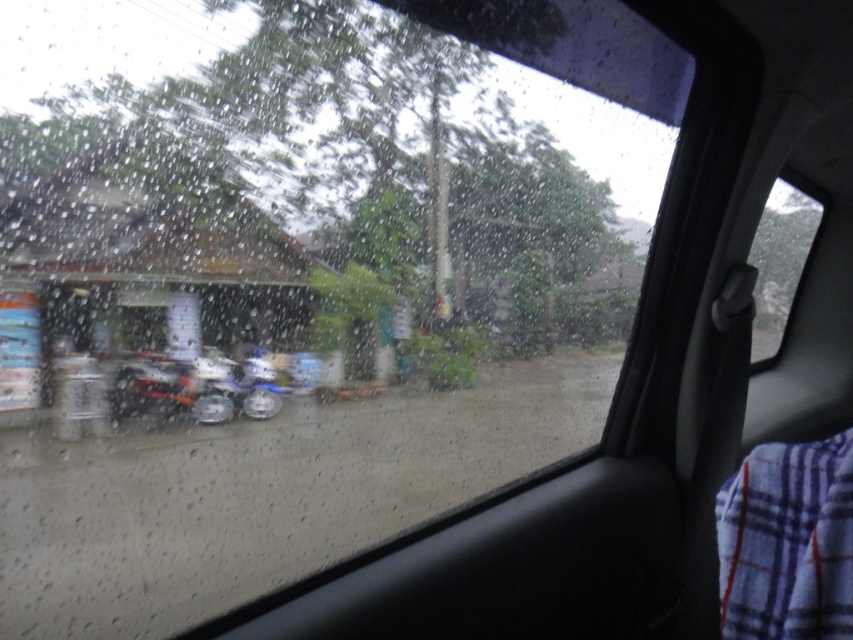
Question: Which object is closer to the camera taking this photo?

Choices:
 (A) metallic silver motorcycle at center
 (B) transparent glass window at center

Answer: (B)

Question: Is transparent glass window at center thinner than metallic silver motorcycle at center?

Choices:
 (A) no
 (B) yes

Answer: (B)

Question: Is transparent glass window at center to the left of metallic silver motorcycle at center from the viewer's perspective?

Choices:
 (A) yes
 (B) no

Answer: (B)

Question: Is transparent glass window at center smaller than metallic silver motorcycle at center?

Choices:
 (A) no
 (B) yes

Answer: (A)